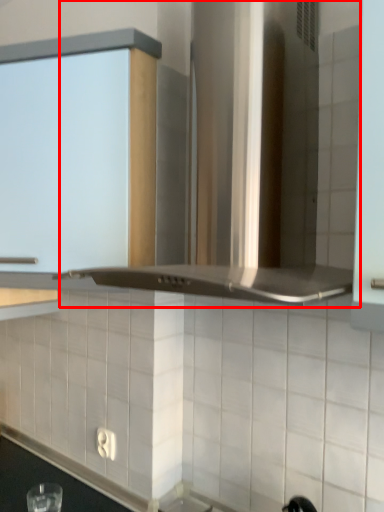
Question: From the image's perspective, what is the correct spatial positioning of vent (annotated by the red box) in reference to cabinetry?

Choices:
 (A) below
 (B) above

Answer: (B)